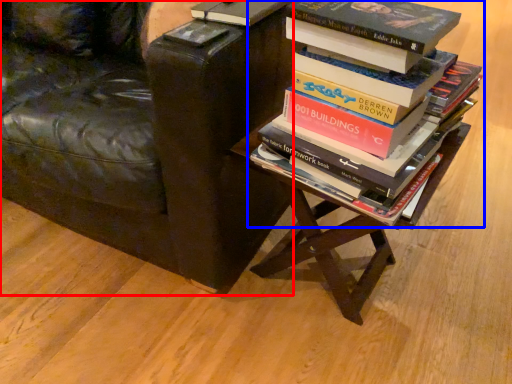
Question: Which object is further to the camera taking this photo, chair (highlighted by a red box) or book (highlighted by a blue box)?

Choices:
 (A) chair
 (B) book

Answer: (A)